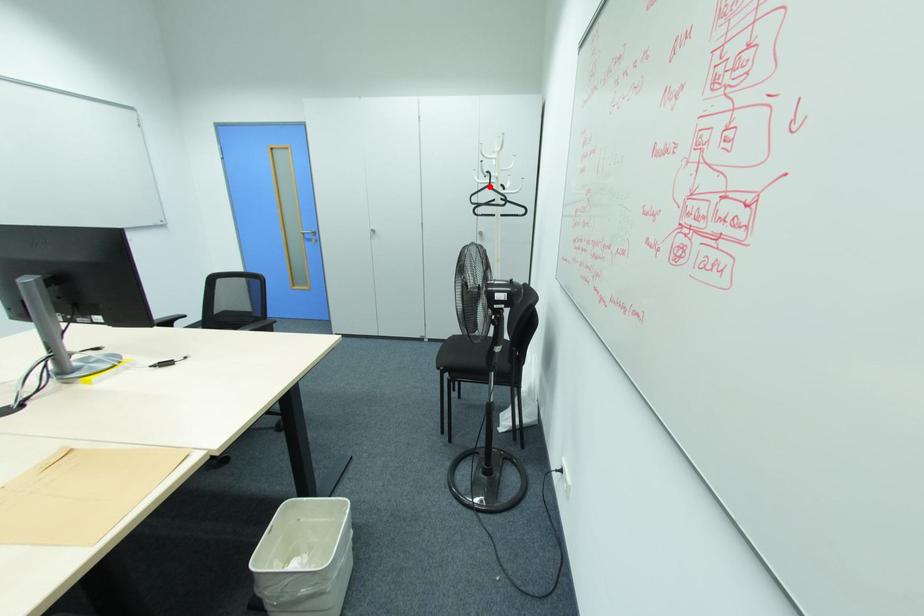
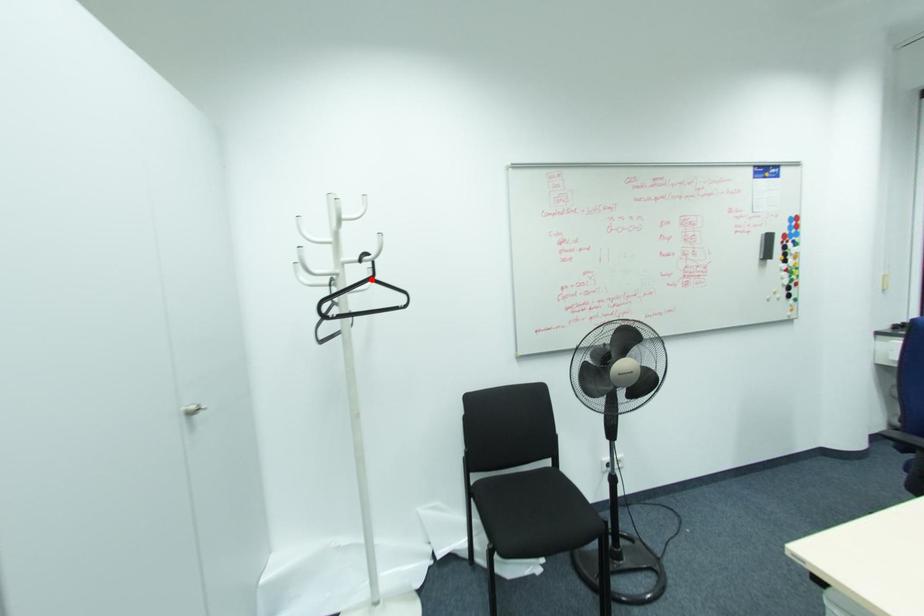
Based on the photo, I am providing you with two images of the same scene from different viewpoints. A red point is marked on the first image and another point is marked on the second image. Are the points marked in image1 and image2 representing the same 3D position?

Yes